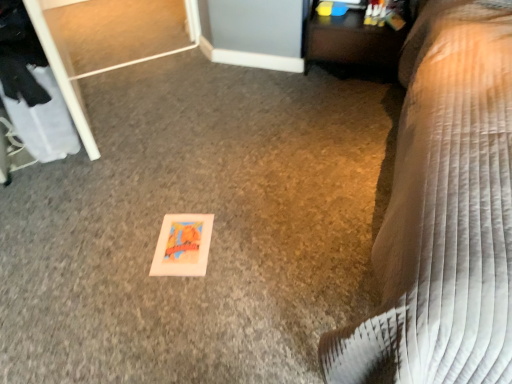
In order to face brown quilted bedspread at lower right, should I rotate leftwards or rightwards?

Rotate right and turn 27.577 degrees.

What do you see at coordinates (444, 211) in the screenshot?
I see `brown quilted bedspread at lower right` at bounding box center [444, 211].

What is the approximate width of brown quilted bedspread at lower right?

The width of brown quilted bedspread at lower right is 7.93 feet.

The image size is (512, 384). I want to click on brown quilted bedspread at lower right, so pos(444,211).

Image resolution: width=512 pixels, height=384 pixels. I want to click on wooden table at upper right, so click(x=354, y=45).

What do you see at coordinates (354, 45) in the screenshot? Image resolution: width=512 pixels, height=384 pixels. I see `wooden table at upper right` at bounding box center [354, 45].

You are a GUI agent. You are given a task and a screenshot of the screen. Output one action in this format:
    pyautogui.click(x=<x>, y=<y>)
    Task: Click on the brown quilted bedspread at lower right
    The image size is (512, 384).
    Given the screenshot: What is the action you would take?
    pyautogui.click(x=444, y=211)

Visually, is wooden table at upper right positioned to the left or to the right of brown quilted bedspread at lower right?

wooden table at upper right is to the left of brown quilted bedspread at lower right.

Which object is further away from the camera taking this photo, wooden table at upper right or brown quilted bedspread at lower right?

wooden table at upper right is more distant.

Considering the positions of points (377, 72) and (502, 10), is point (377, 72) closer to camera compared to point (502, 10)?

No, (377, 72) is further to viewer.

From the image's perspective, is wooden table at upper right under brown quilted bedspread at lower right?

No, from the image's perspective, wooden table at upper right is not beneath brown quilted bedspread at lower right.

From a real-world perspective, is wooden table at upper right under brown quilted bedspread at lower right?

Yes, from a real-world perspective, wooden table at upper right is below brown quilted bedspread at lower right.

Can you confirm if wooden table at upper right is wider than brown quilted bedspread at lower right?

No.

Who is shorter, wooden table at upper right or brown quilted bedspread at lower right?

wooden table at upper right is shorter.

Looking at this image, between wooden table at upper right and brown quilted bedspread at lower right, which one has smaller size?

Smaller between the two is wooden table at upper right.

Does wooden table at upper right contain brown quilted bedspread at lower right?

No, brown quilted bedspread at lower right is not inside wooden table at upper right.

Is wooden table at upper right beside brown quilted bedspread at lower right?

No, wooden table at upper right is not in contact with brown quilted bedspread at lower right.

Is wooden table at upper right oriented towards brown quilted bedspread at lower right?

Yes.

Find the location of a particular element. This screenshot has width=512, height=384. furniture in front of the wooden table at upper right is located at coordinates (444, 211).

Can you confirm if brown quilted bedspread at lower right is positioned to the left of wooden table at upper right?

No.

Is brown quilted bedspread at lower right in front of or behind wooden table at upper right in the image?

Visually, brown quilted bedspread at lower right is located in front of wooden table at upper right.

Is point (454, 90) closer to camera compared to point (382, 69)?

Yes, point (454, 90) is closer to viewer.

From the image's perspective, which one is positioned higher, brown quilted bedspread at lower right or wooden table at upper right?

From the image's view, wooden table at upper right is above.

From a real-world perspective, who is located lower, brown quilted bedspread at lower right or wooden table at upper right?

In real-world perspective, wooden table at upper right is lower.

Does brown quilted bedspread at lower right have a greater width compared to wooden table at upper right?

Correct, the width of brown quilted bedspread at lower right exceeds that of wooden table at upper right.

Who is shorter, brown quilted bedspread at lower right or wooden table at upper right?

wooden table at upper right is shorter.

Is brown quilted bedspread at lower right bigger than wooden table at upper right?

Correct, brown quilted bedspread at lower right is larger in size than wooden table at upper right.

Is brown quilted bedspread at lower right located outside wooden table at upper right?

That's correct, brown quilted bedspread at lower right is outside of wooden table at upper right.

Is brown quilted bedspread at lower right next to wooden table at upper right?

No.

Could you tell me if brown quilted bedspread at lower right is turned towards wooden table at upper right?

No, brown quilted bedspread at lower right is not aimed at wooden table at upper right.

How different are the orientations of brown quilted bedspread at lower right and wooden table at upper right in degrees?

They differ by 0.298 degrees in their facing directions.

You are a GUI agent. You are given a task and a screenshot of the screen. Output one action in this format:
    pyautogui.click(x=<x>, y=<y>)
    Task: Click on the table that is on the left side of brown quilted bedspread at lower right
    The image size is (512, 384).
    Given the screenshot: What is the action you would take?
    pyautogui.click(x=354, y=45)

At what (x,y) coordinates should I click in order to perform the action: click on furniture that is below the wooden table at upper right (from the image's perspective). Please return your answer as a coordinate pair (x, y). Looking at the image, I should click on (444, 211).

At what (x,y) coordinates should I click in order to perform the action: click on furniture located in front of the wooden table at upper right. Please return your answer as a coordinate pair (x, y). Looking at the image, I should click on (444, 211).